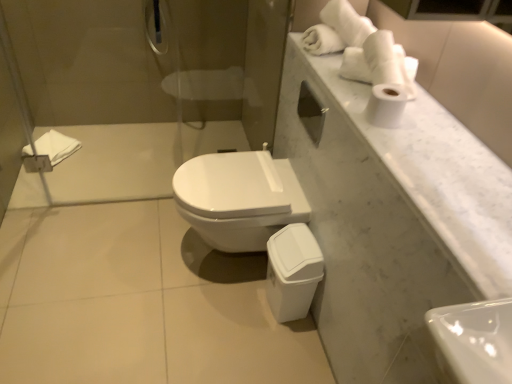
This screenshot has height=384, width=512. Find the location of `free space in front of white matte toilet paper at upper right`. free space in front of white matte toilet paper at upper right is located at coordinates 396,145.